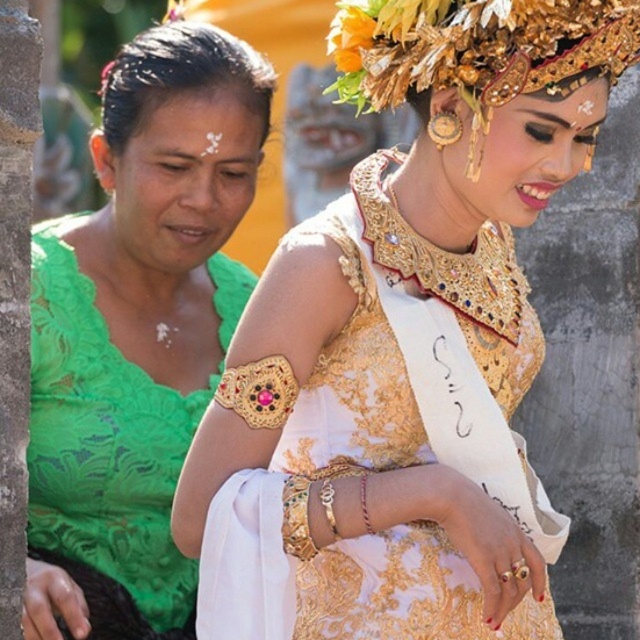
You are a photographer trying to capture a photo of the gold textured dress at center and the green lace blouse at left. Which one should you focus on first if you want to capture the one closer to the camera?

The green lace blouse at left is closer to the camera than the gold textured dress at center, so you should focus on the green lace blouse at left first.